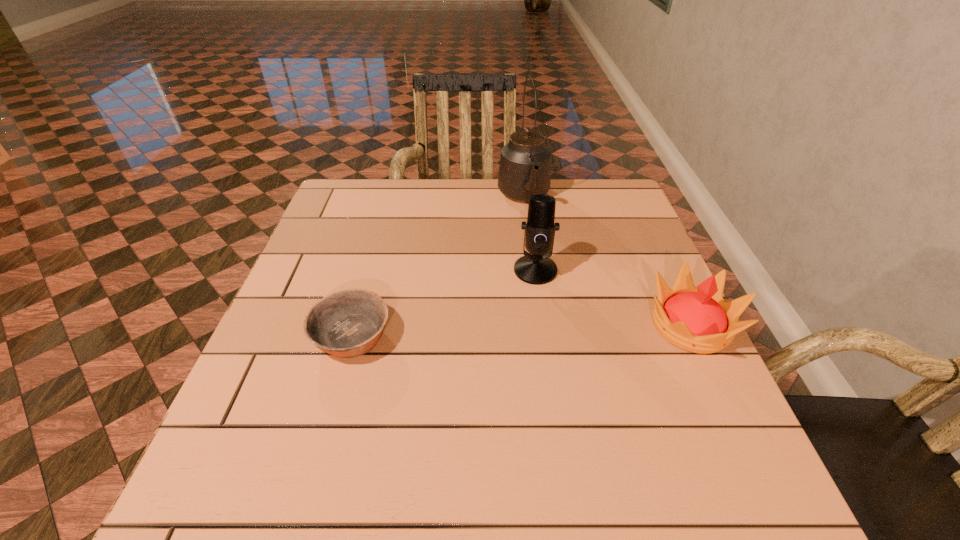
At what (x,y) coordinates should I click in order to perform the action: click on vacant space at the near edge. Please return your answer as a coordinate pair (x, y). Looking at the image, I should click on (620, 426).

I want to click on free spot at the left edge of the desktop, so click(300, 320).

Where is `free space at the right edge`? This screenshot has height=540, width=960. free space at the right edge is located at coordinates tap(696, 401).

The image size is (960, 540). Identify the location of vacant space at the near left corner. (300, 435).

I want to click on vacant space at the far right corner of the desktop, so click(x=582, y=200).

In the image, there is a desktop. Identify the location of vacant space at the near right corner. (685, 418).

Where is `unoccupied position between the shortest object and the farthest object`? unoccupied position between the shortest object and the farthest object is located at coordinates (438, 266).

The width and height of the screenshot is (960, 540). I want to click on vacant region between the rightmost object and the second farthest object, so click(613, 298).

Where is `vacant point located between the crown and the bowl`? vacant point located between the crown and the bowl is located at coordinates (521, 330).

The image size is (960, 540). Find the location of `vacant point located between the bowl and the farthest object`. vacant point located between the bowl and the farthest object is located at coordinates (438, 266).